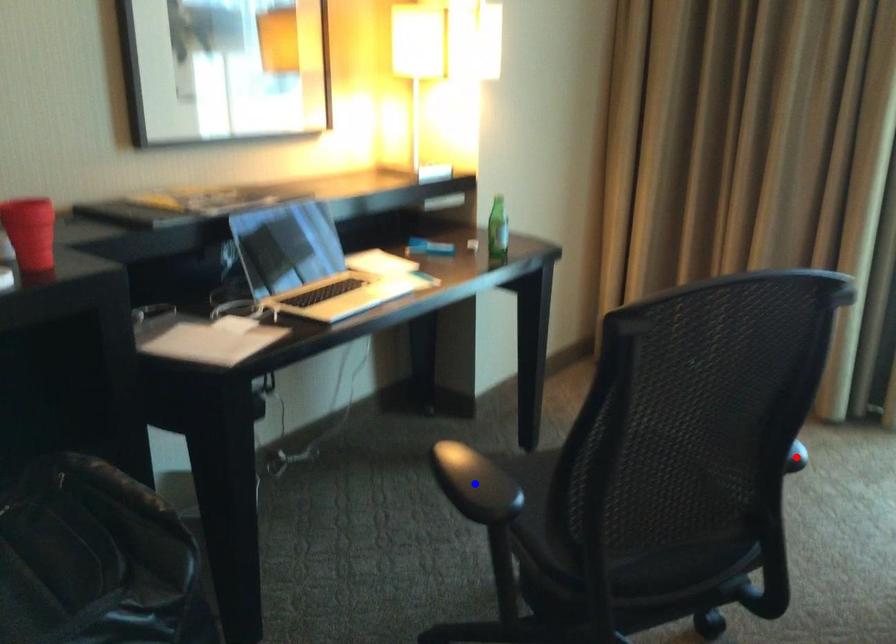
Question: In the image, two points are highlighted. Which point is nearer to the camera? Reply with the corresponding letter.

Choices:
 (A) blue point
 (B) red point

Answer: (A)